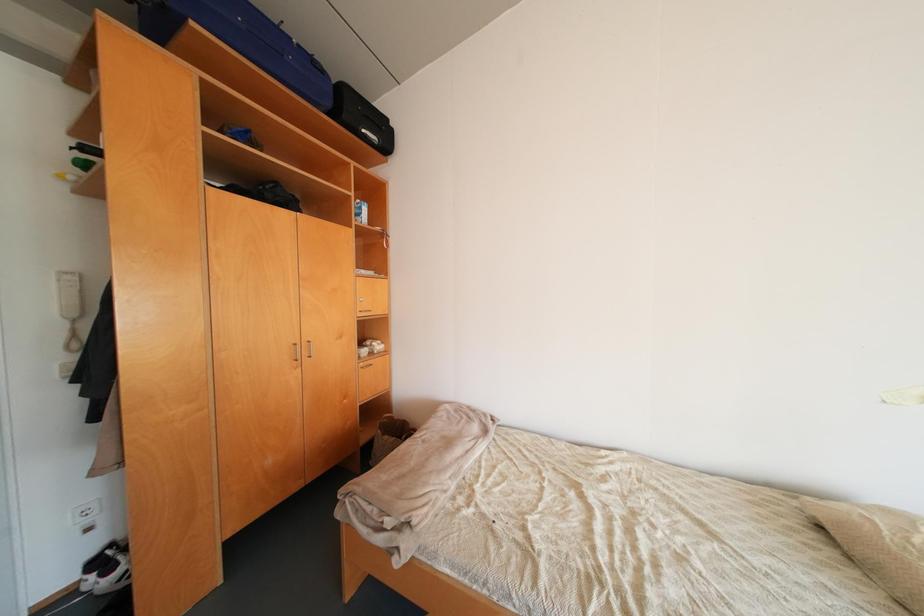
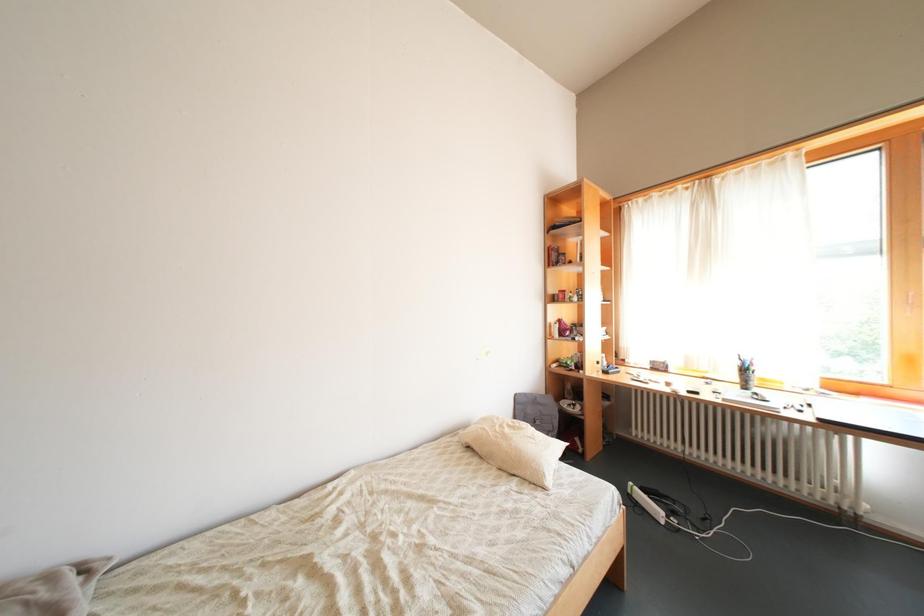
Question: The camera is either moving clockwise (left) or counter-clockwise (right) around the object. The first image is from the beginning of the video and the second image is from the end. Is the camera moving left or right when shooting the video?

Choices:
 (A) Left
 (B) Right

Answer: (A)